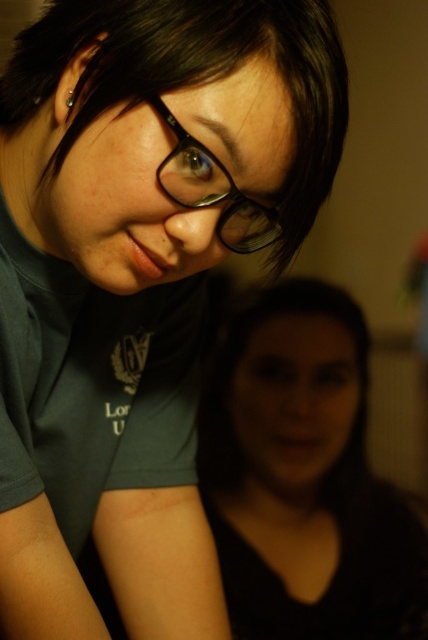
Question: Is black matte hair at lower center further to the viewer compared to black matte glasses at upper center?

Choices:
 (A) yes
 (B) no

Answer: (A)

Question: Is black matte hair at lower center positioned before black matte glasses at upper center?

Choices:
 (A) yes
 (B) no

Answer: (B)

Question: Which point is farther from the camera taking this photo?

Choices:
 (A) (255, 422)
 (B) (237, 204)

Answer: (A)

Question: Which object is closer to the camera taking this photo?

Choices:
 (A) black matte glasses at upper center
 (B) black matte hair at lower center

Answer: (A)

Question: Can you confirm if black matte hair at lower center is positioned to the right of black matte glasses at upper center?

Choices:
 (A) yes
 (B) no

Answer: (A)